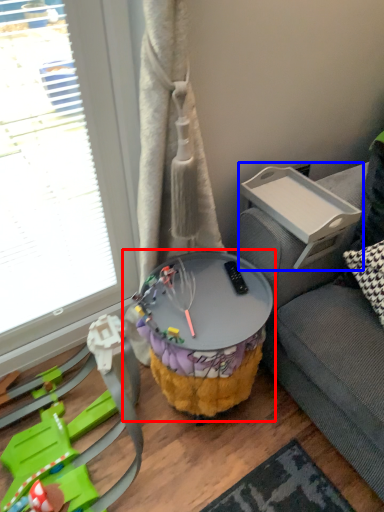
Question: Which point is further to the camera, table (highlighted by a red box) or table (highlighted by a blue box)?

Choices:
 (A) table
 (B) table

Answer: (B)